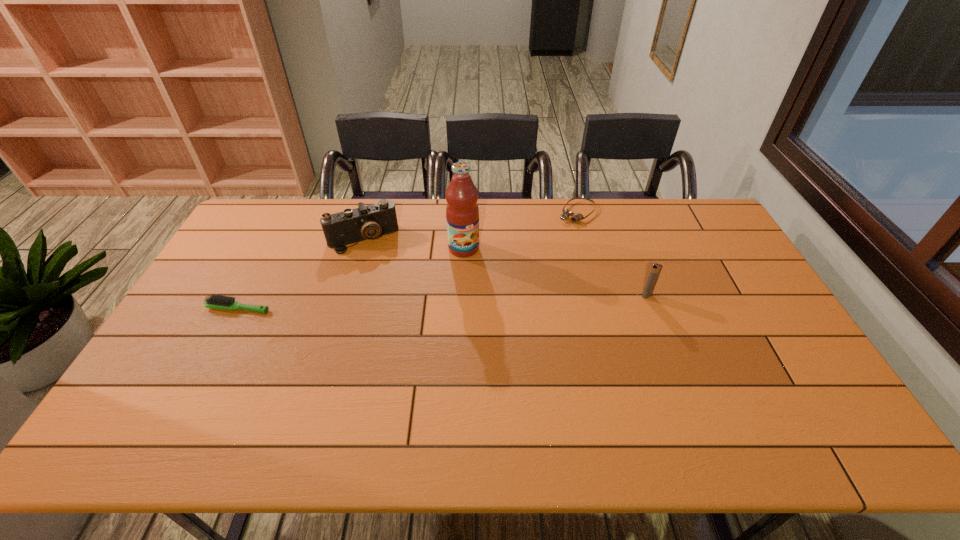
Where is `goggles situated at the far edge`? goggles situated at the far edge is located at coordinates (566, 213).

Image resolution: width=960 pixels, height=540 pixels. I want to click on object that is at the left edge, so click(x=214, y=301).

I want to click on free space at the far edge, so click(x=607, y=206).

In the image, there is a desktop. What are the coordinates of `free space at the near edge` in the screenshot? It's located at (707, 380).

The image size is (960, 540). What are the coordinates of `free space at the left edge of the desktop` in the screenshot? It's located at (206, 367).

I want to click on free region at the right edge of the desktop, so click(797, 359).

Where is `vacant space at the far right corner of the desktop`? The height and width of the screenshot is (540, 960). vacant space at the far right corner of the desktop is located at coordinates (695, 204).

Identify the location of free point between the fruit juice and the fourth object from left to right. (520, 230).

At what (x,y) coordinates should I click in order to perform the action: click on vacant area that lies between the rightmost object and the third object from right to left. Please return your answer as a coordinate pair (x, y). This screenshot has height=540, width=960. Looking at the image, I should click on (555, 272).

You are a GUI agent. You are given a task and a screenshot of the screen. Output one action in this format:
    pyautogui.click(x=<x>, y=<y>)
    Task: Click on the vacant point located between the tallest object and the fourth object from right to left
    Image resolution: width=960 pixels, height=540 pixels.
    Given the screenshot: What is the action you would take?
    pyautogui.click(x=413, y=244)